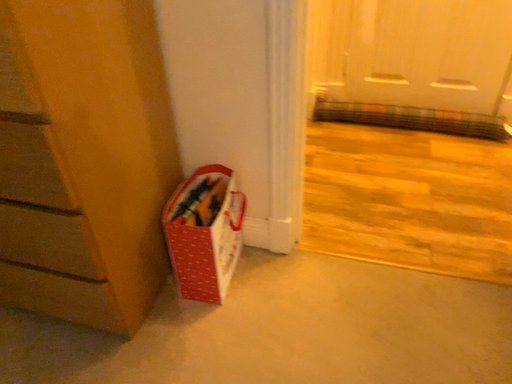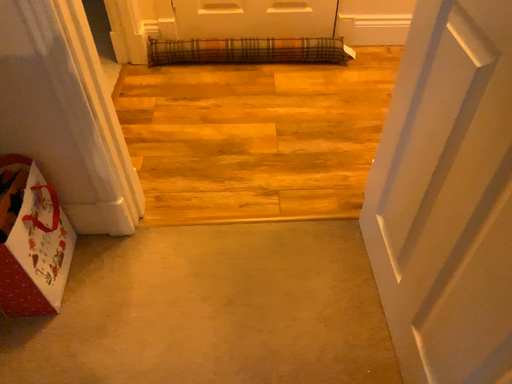
Question: Which way did the camera rotate in the video?

Choices:
 (A) rotated downward
 (B) rotated upward

Answer: (A)